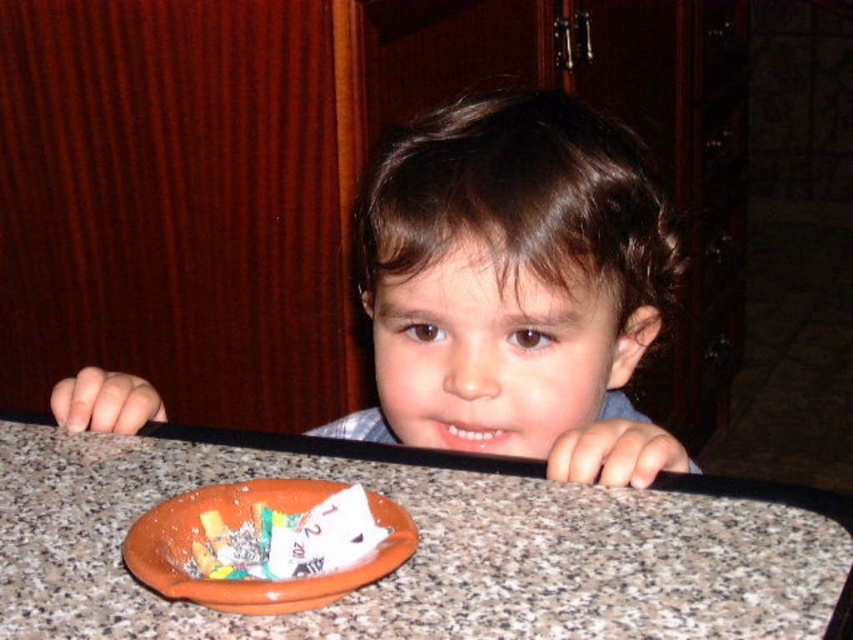
Question: Which point is closer to the camera?

Choices:
 (A) (555, 211)
 (B) (424, 609)
 (C) (225, 540)

Answer: (B)

Question: Estimate the real-world distances between objects in this image. Which object is closer to the brown marble table at center?

Choices:
 (A) white paper candy at center
 (B) brown hair at center

Answer: (A)

Question: Where is brown marble table at center located in relation to brown hair at center in the image?

Choices:
 (A) right
 (B) left

Answer: (B)

Question: Does brown marble table at center lie in front of white paper candy at center?

Choices:
 (A) no
 (B) yes

Answer: (B)

Question: Based on their relative distances, which object is farther from the brown hair at center?

Choices:
 (A) white paper candy at center
 (B) brown marble table at center

Answer: (A)

Question: Does brown marble table at center lie in front of white paper candy at center?

Choices:
 (A) yes
 (B) no

Answer: (A)